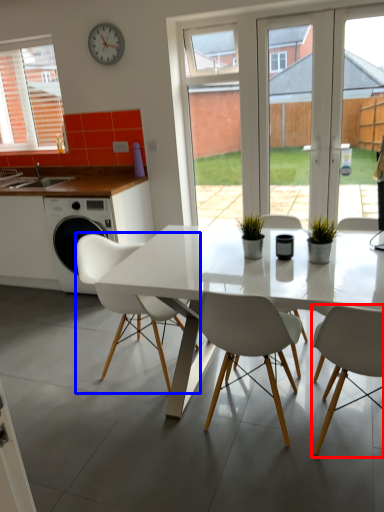
Question: Among these objects, which one is farthest to the camera, chair (highlighted by a red box) or chair (highlighted by a blue box)?

Choices:
 (A) chair
 (B) chair

Answer: (B)